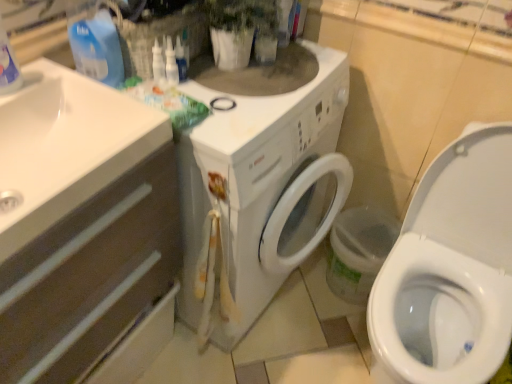
The width and height of the screenshot is (512, 384). Describe the element at coordinates (97, 48) in the screenshot. I see `blue plastic bottle at upper left` at that location.

The width and height of the screenshot is (512, 384). Describe the element at coordinates (90, 276) in the screenshot. I see `white matte drawer at left` at that location.

Measure the distance between point (135, 179) and camera.

33.19 inches.

Locate an element on the screen. Image resolution: width=512 pixels, height=384 pixels. white glossy sink at left is located at coordinates (66, 146).

Looking at this image, which is less distant, (145, 144) or (118, 55)?

The point (145, 144) is more forward.

Does white glossy sink at left contain blue plastic bottle at upper left?

Actually, blue plastic bottle at upper left is outside white glossy sink at left.

Considering the sizes of objects white glossy sink at left and blue plastic bottle at upper left in the image provided, who is shorter, white glossy sink at left or blue plastic bottle at upper left?

white glossy sink at left.

From a real-world perspective, is white matte drawer at left positioned above or below white glossy sink at left?

From a real-world perspective, white matte drawer at left is physically below white glossy sink at left.

Is white matte drawer at left not within white glossy sink at left?

Yes, white matte drawer at left is not within white glossy sink at left.

You are a GUI agent. You are given a task and a screenshot of the screen. Output one action in this format:
    pyautogui.click(x=<x>, y=<y>)
    Task: Click on the sink that is above the white matte drawer at left (from a real-world perspective)
    The width and height of the screenshot is (512, 384).
    Given the screenshot: What is the action you would take?
    pyautogui.click(x=66, y=146)

Considering the sizes of white matte drawer at left and white glossy sink at left in the image, is white matte drawer at left taller or shorter than white glossy sink at left?

Clearly, white matte drawer at left is taller compared to white glossy sink at left.

In the image, there is a white glossy sink at left. At what (x,y) coordinates should I click in order to perform the action: click on drawer below it (from a real-world perspective). Please return your answer as a coordinate pair (x, y). Looking at the image, I should click on pos(90,276).

Looking at this image, is the depth of white glossy sink at left greater than that of white matte drawer at left?

Yes, it is.

Considering the sizes of objects white glossy sink at left and white matte drawer at left in the image provided, who is bigger, white glossy sink at left or white matte drawer at left?

Bigger between the two is white matte drawer at left.

Consider the image. Does white glossy sink at left have a greater height compared to white matte drawer at left?

No.

How many degrees apart are the facing directions of blue plastic bottle at upper left and white glossy sink at left?

The facing directions of blue plastic bottle at upper left and white glossy sink at left are 0.00115 degrees apart.

Could white glossy sink at left be considered to be inside blue plastic bottle at upper left?

No, blue plastic bottle at upper left does not contain white glossy sink at left.

From the picture: Who is bigger, blue plastic bottle at upper left or white glossy sink at left?

With larger size is white glossy sink at left.

From the image's perspective, is blue plastic bottle at upper left over white glossy sink at left?

Yes, from the image's perspective, blue plastic bottle at upper left is on top of white glossy sink at left.

Consider the image. Between blue plastic bottle at upper left and white matte drawer at left, which one has smaller width?

With smaller width is blue plastic bottle at upper left.

Is point (77, 58) positioned behind point (126, 266)?

Yes, it is behind point (126, 266).

Based on the photo, are blue plastic bottle at upper left and white matte drawer at left located far from each other?

blue plastic bottle at upper left is actually quite close to white matte drawer at left.

From their relative heights in the image, would you say white matte drawer at left is taller or shorter than blue plastic bottle at upper left?

In the image, white matte drawer at left appears to be taller than blue plastic bottle at upper left.

Would you say white matte drawer at left is a long distance from blue plastic bottle at upper left?

Result: That's not correct — white matte drawer at left is a little close to blue plastic bottle at upper left.

Does white matte drawer at left have a larger size compared to blue plastic bottle at upper left?

Yes, white matte drawer at left is bigger than blue plastic bottle at upper left.

Image resolution: width=512 pixels, height=384 pixels. In the image, there is a blue plastic bottle at upper left. Identify the location of drawer below it (from the image's perspective). (90, 276).

Identify the location of sink below the blue plastic bottle at upper left (from the image's perspective). The height and width of the screenshot is (384, 512). (66, 146).

What are the coordinates of `drawer on the left of white glossy sink at left` in the screenshot? It's located at (90, 276).

When comparing their distances from white matte drawer at left, does white glossy sink at left or blue plastic bottle at upper left seem further?

Among the two, blue plastic bottle at upper left is located further to white matte drawer at left.

Based on their spatial positions, is blue plastic bottle at upper left or white glossy sink at left closer to white matte drawer at left?

white glossy sink at left lies closer to white matte drawer at left than the other object.

Which object lies further to the anchor point white glossy sink at left, blue plastic bottle at upper left or white matte drawer at left?

blue plastic bottle at upper left.

From the image, which object appears to be nearer to blue plastic bottle at upper left, white glossy sink at left or white matte drawer at left?

white glossy sink at left lies closer to blue plastic bottle at upper left than the other object.

Consider the image. Considering their positions, is white matte drawer at left positioned further to white glossy sink at left than blue plastic bottle at upper left?

Among the two, blue plastic bottle at upper left is located further to white glossy sink at left.

Estimate the real-world distances between objects in this image. Which object is closer to blue plastic bottle at upper left, white matte drawer at left or white glossy sink at left?

Among the two, white glossy sink at left is located nearer to blue plastic bottle at upper left.

What are the coordinates of `sink between blue plastic bottle at upper left and white matte drawer at left in the up-down direction` in the screenshot? It's located at (66, 146).